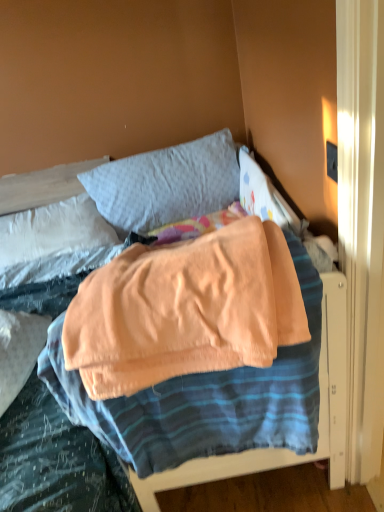
Question: Considering the relative positions of gray cotton pillow at upper center, which is counted as the first pillow, starting from the right, and light gray fabric pillow at upper left, which is the 1th pillow in left-to-right order, in the image provided, is gray cotton pillow at upper center, which is counted as the first pillow, starting from the right, behind light gray fabric pillow at upper left, which is the 1th pillow in left-to-right order,?

Choices:
 (A) no
 (B) yes

Answer: (A)

Question: Does gray cotton pillow at upper center, which is counted as the second pillow, starting from the left, have a lesser width compared to light gray fabric pillow at upper left, the 2th pillow positioned from the right?

Choices:
 (A) yes
 (B) no

Answer: (A)

Question: From the image's perspective, is gray cotton pillow at upper center, which is counted as the second pillow, starting from the left, above light gray fabric pillow at upper left, the 2th pillow positioned from the right?

Choices:
 (A) no
 (B) yes

Answer: (B)

Question: Is gray cotton pillow at upper center, which is counted as the second pillow, starting from the left, facing away from light gray fabric pillow at upper left, which is the 1th pillow in left-to-right order?

Choices:
 (A) no
 (B) yes

Answer: (A)

Question: Can you confirm if gray cotton pillow at upper center, which is counted as the first pillow, starting from the right, is positioned to the right of light gray fabric pillow at upper left, the 2th pillow positioned from the right?

Choices:
 (A) no
 (B) yes

Answer: (B)

Question: Considering the positions of gray cotton pillow at upper center, which is counted as the first pillow, starting from the right, and soft peach blanket at center in the image, is gray cotton pillow at upper center, which is counted as the first pillow, starting from the right, wider or thinner than soft peach blanket at center?

Choices:
 (A) thin
 (B) wide

Answer: (A)

Question: Looking at the image, does gray cotton pillow at upper center, which is counted as the second pillow, starting from the left, seem bigger or smaller compared to soft peach blanket at center?

Choices:
 (A) small
 (B) big

Answer: (A)

Question: Is gray cotton pillow at upper center, which is counted as the first pillow, starting from the right, inside the boundaries of soft peach blanket at center, or outside?

Choices:
 (A) outside
 (B) inside

Answer: (A)

Question: Considering the relative positions of gray cotton pillow at upper center, which is counted as the first pillow, starting from the right, and soft peach blanket at center in the image provided, is gray cotton pillow at upper center, which is counted as the first pillow, starting from the right, to the left or to the right of soft peach blanket at center?

Choices:
 (A) right
 (B) left

Answer: (B)

Question: Is light gray fabric pillow at upper left, which is the 1th pillow in left-to-right order, taller or shorter than matte black outlet at upper right?

Choices:
 (A) tall
 (B) short

Answer: (A)

Question: Is point (1, 227) positioned closer to the camera than point (327, 145)?

Choices:
 (A) closer
 (B) farther

Answer: (B)

Question: In the image, is light gray fabric pillow at upper left, the 2th pillow positioned from the right, positioned in front of or behind matte black outlet at upper right?

Choices:
 (A) front
 (B) behind

Answer: (B)

Question: Based on their sizes in the image, would you say light gray fabric pillow at upper left, the 2th pillow positioned from the right, is bigger or smaller than matte black outlet at upper right?

Choices:
 (A) big
 (B) small

Answer: (A)

Question: Relative to light gray fabric pillow at upper left, the 2th pillow positioned from the right, is matte black outlet at upper right in front or behind?

Choices:
 (A) behind
 (B) front

Answer: (B)

Question: Is matte black outlet at upper right situated inside light gray fabric pillow at upper left, which is the 1th pillow in left-to-right order, or outside?

Choices:
 (A) inside
 (B) outside

Answer: (B)